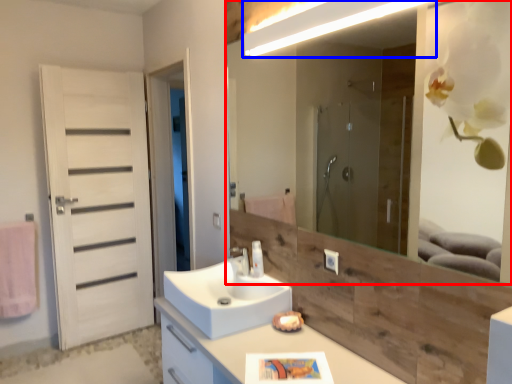
Question: Among these objects, which one is farthest to the camera, mirror (highlighted by a red box) or light fixture (highlighted by a blue box)?

Choices:
 (A) mirror
 (B) light fixture

Answer: (B)